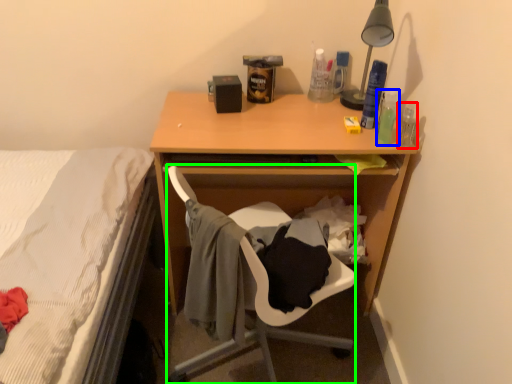
Question: Based on their relative distances, which object is farther from bottle (highlighted by a red box)? Choose from bottle (highlighted by a blue box) and chair (highlighted by a green box).

Choices:
 (A) bottle
 (B) chair

Answer: (B)